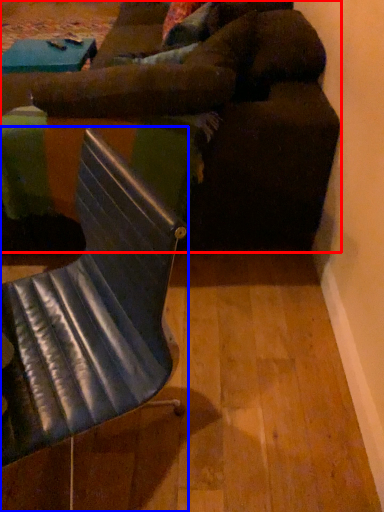
Question: Among these objects, which one is farthest to the camera, studio couch (highlighted by a red box) or chair (highlighted by a blue box)?

Choices:
 (A) studio couch
 (B) chair

Answer: (A)